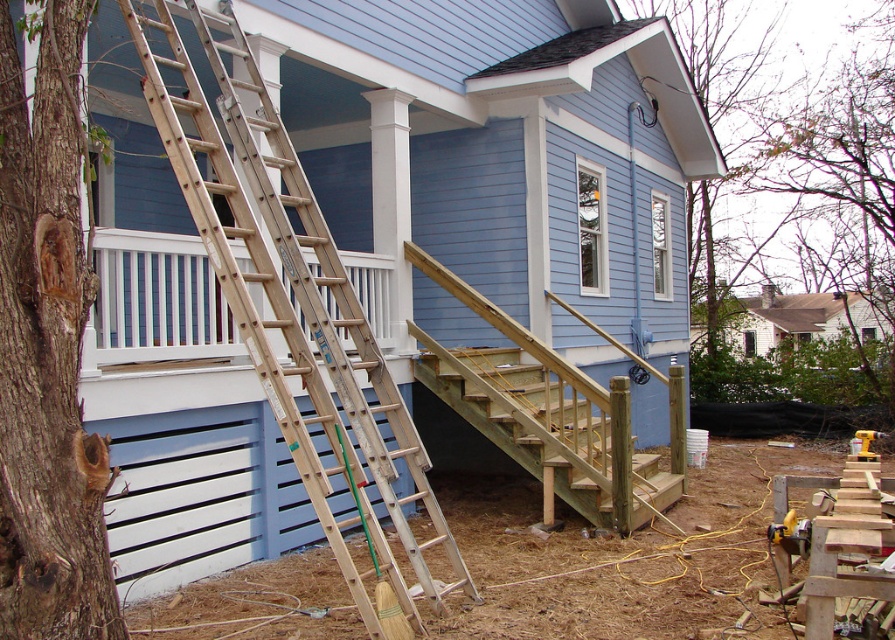
You are a construction worker standing at the entrance of the house. You need to access the second floor window which is at the same height as the top of the wooden ladder at left. Can you reach it using the ladder?

The wooden ladder at left is located at point (293,305), so the ladder is positioned near the bottom of the stairs. Since the second floor window is at the same height as the top of the ladder, you can climb the wooden ladder at left to reach it.

You are a construction worker who needs to place a 2m ladder between the brown rough bark tree at left and the wooden stairs at center. Since the tree is taller than the stairs, where should you position the ladder to ensure it doesn

The brown rough bark tree at left is taller than the wooden stairs at center. To place the 2m ladder between them without it being obstructed by the tree, position it closer to the wooden stairs at center where the height is lower.